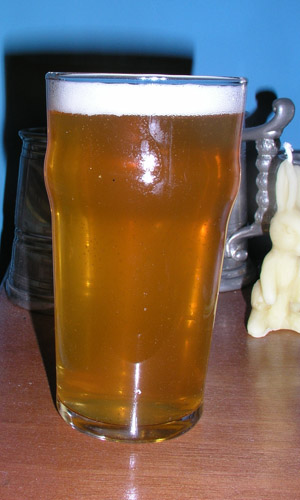
This screenshot has width=300, height=500. I want to click on rabbit shaped candle, so click(284, 279).